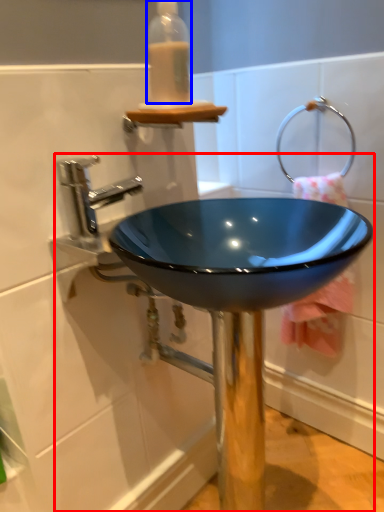
Question: Among these objects, which one is farthest to the camera, sink (highlighted by a red box) or bottle (highlighted by a blue box)?

Choices:
 (A) sink
 (B) bottle

Answer: (B)